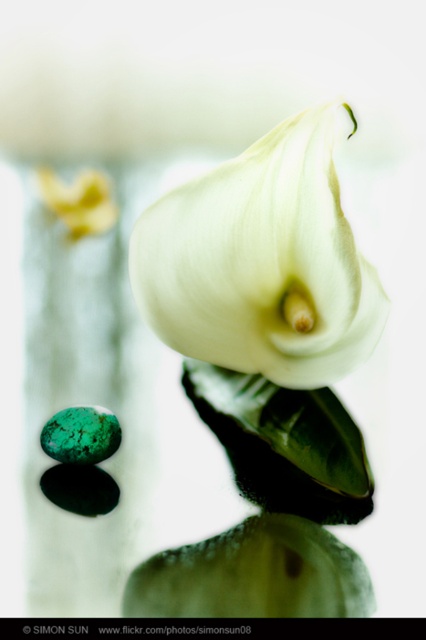
You are holding a small sculpture that is 0.5 meters tall. You want to place it on the reflective surface where the dark green stones are located, but you need to ensure there is enough space between the sculpture and the white matte calla lily at center. How much distance should you leave between them?

The white matte calla lily at center is 1.07 meters away from the viewer. To ensure enough space between the sculpture and the flower, you should leave at least 1.07 meters minus the sculpture height of 0.5 meters, resulting in a minimum distance of 0.57 meters between them.